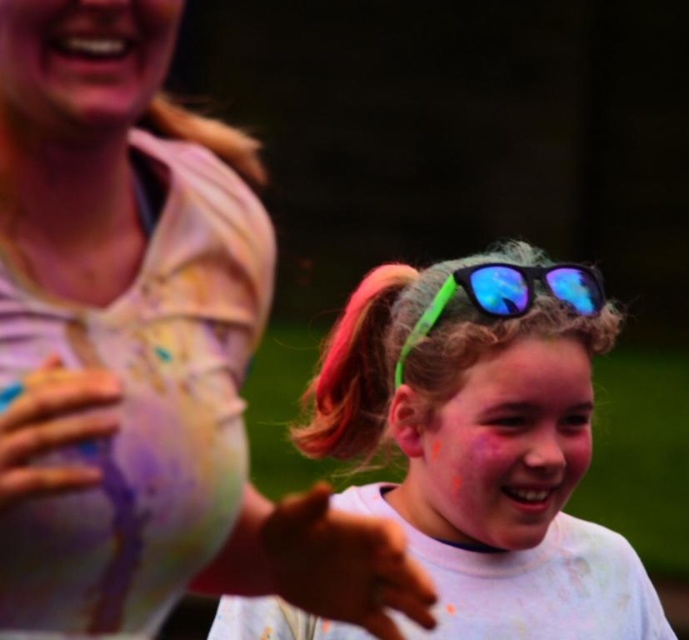
Based on the photo, is matte white face at center smaller than matte skin at upper left?

Actually, matte white face at center might be larger than matte skin at upper left.

Can you confirm if matte white face at center is taller than matte skin at upper left?

Indeed, matte white face at center has a greater height compared to matte skin at upper left.

Identify the location of matte white face at center. The height and width of the screenshot is (640, 689). tap(497, 445).

Based on the photo, does matte skin at upper left have a larger size compared to smooth white glove at left?

Result: Correct, matte skin at upper left is larger in size than smooth white glove at left.

Does point (30, 4) come closer to viewer compared to point (17, 428)?

No, (30, 4) is behind (17, 428).

Who is more distant from viewer, (50,76) or (71,422)?

Positioned behind is point (50,76).

Where is `matte skin at upper left`? The height and width of the screenshot is (640, 689). matte skin at upper left is located at coordinates (83, 60).

Does neon green plastic sunglasses at center have a larger size compared to smooth white glove at left?

Indeed, neon green plastic sunglasses at center has a larger size compared to smooth white glove at left.

Can you confirm if neon green plastic sunglasses at center is wider than smooth white glove at left?

Correct, the width of neon green plastic sunglasses at center exceeds that of smooth white glove at left.

Locate an element on the screen. neon green plastic sunglasses at center is located at coordinates (483, 454).